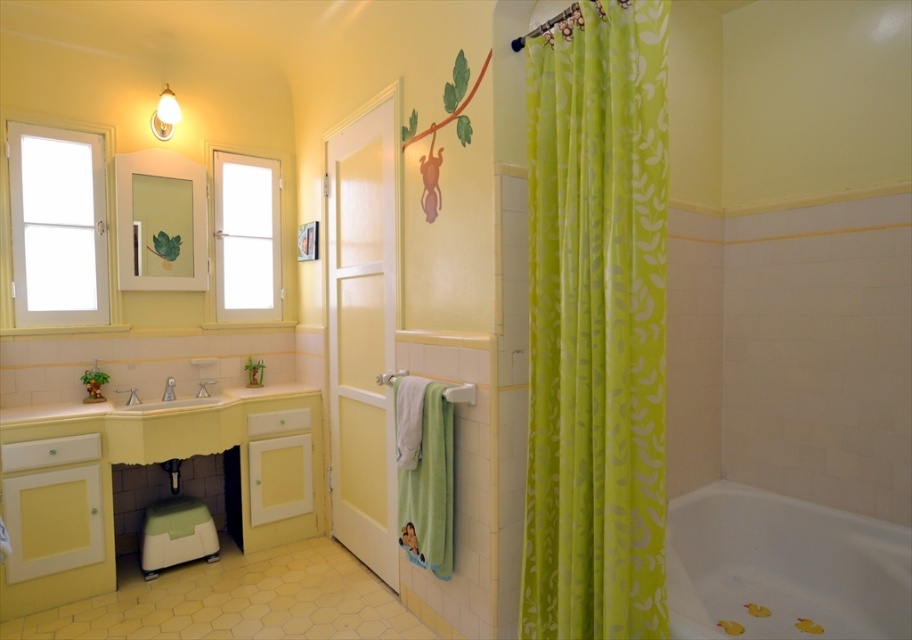
Question: Does white matte window at upper left appear under white plastic towel bar at center?

Choices:
 (A) no
 (B) yes

Answer: (A)

Question: Can you confirm if lime green fabric at right is wider than brushed metal faucet at sink left?

Choices:
 (A) no
 (B) yes

Answer: (B)

Question: Among these points, which one is nearest to the camera?

Choices:
 (A) (395, 380)
 (B) (615, 157)

Answer: (B)

Question: Does transparent glass door at center have a larger size compared to matte white sink at center?

Choices:
 (A) no
 (B) yes

Answer: (B)

Question: Which of the following is the closest to the observer?

Choices:
 (A) (252, 211)
 (B) (385, 372)

Answer: (B)

Question: Estimate the real-world distances between objects in this image. Which object is farther from the white glossy bathtub at lower right?

Choices:
 (A) transparent glass door at center
 (B) white matte window at upper left
 (C) brushed metal faucet at sink left

Answer: (B)